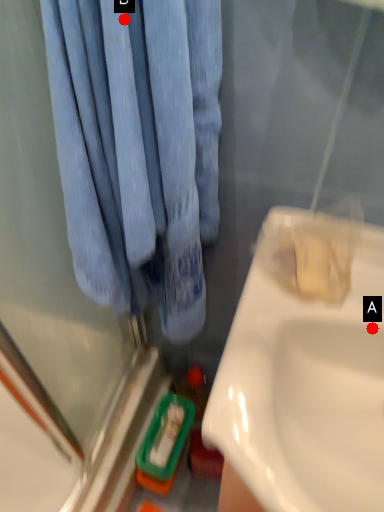
Question: Two points are circled on the image, labeled by A and B beside each circle. Which point is farther to the camera?

Choices:
 (A) A is further
 (B) B is further

Answer: (A)